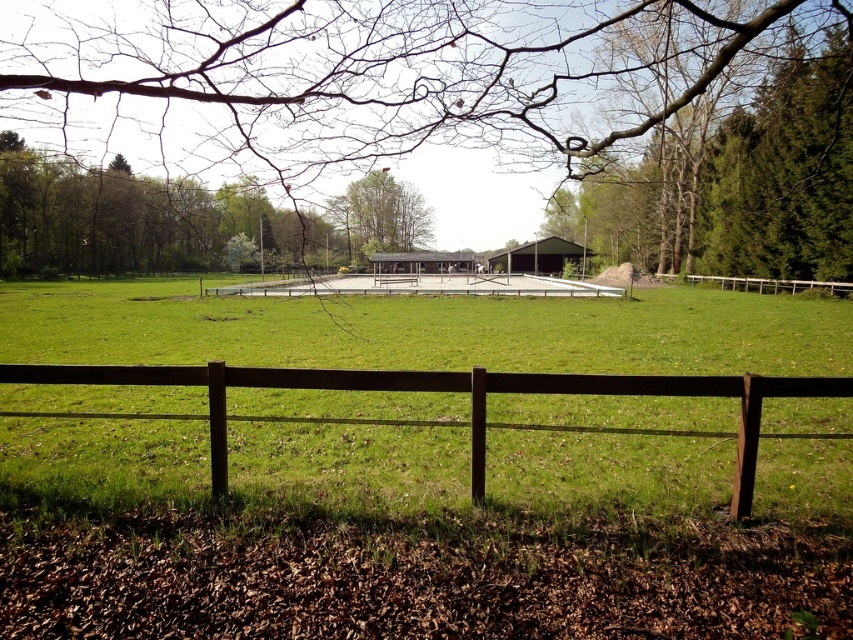
You are planning to plant a new tree in this park. You have two options based on the existing trees. The green leafy tree at left and the green leafy tree at center. Which existing tree should you choose if you want a tree with a wider canopy?

The green leafy tree at left might be wider than green leafy tree at center, so you should choose the green leafy tree at left if you want a wider canopy.

You are planning to hang a bird feeder from the branch. Considering the height of the brown leafless branch at upper center and the green leafy tree at left, which one would allow the bird feeder to be more visible to birds flying overhead?

The green leafy tree at left is taller than the brown leafless branch at upper center, so hanging the bird feeder on the green leafy tree at left would make it more visible to birds flying overhead.